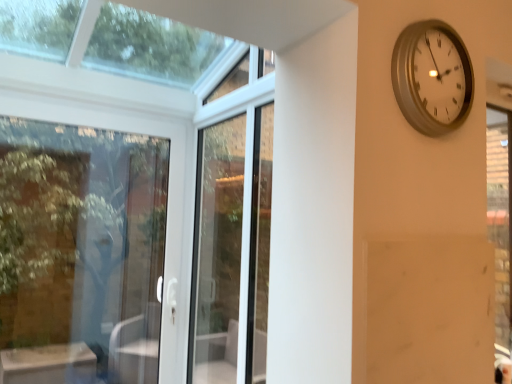
Question: Is silver metallic clock at upper right bigger or smaller than clear glass door at left?

Choices:
 (A) big
 (B) small

Answer: (B)

Question: Considering the positions of silver metallic clock at upper right and clear glass door at left in the image, is silver metallic clock at upper right taller or shorter than clear glass door at left?

Choices:
 (A) tall
 (B) short

Answer: (B)

Question: Estimate the real-world distances between objects in this image. Which object is closer to the silver metallic clock at upper right?

Choices:
 (A) clear glass door at left
 (B) white glass screen door at center

Answer: (B)

Question: Which object is the farthest from the clear glass door at left?

Choices:
 (A) silver metallic clock at upper right
 (B) white glass screen door at center

Answer: (A)